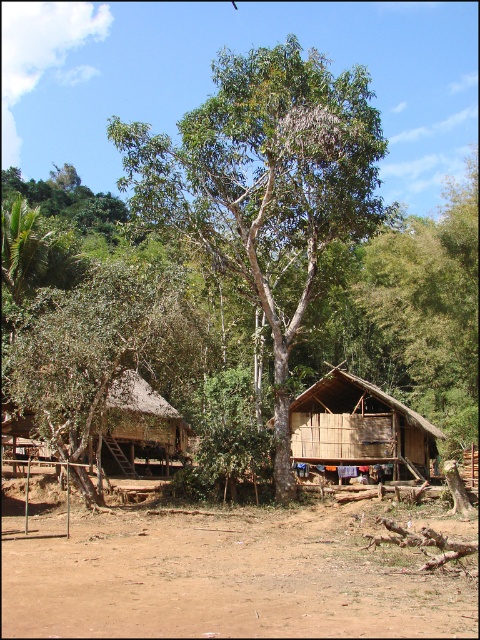
Question: From the image, what is the correct spatial relationship of brown sandy ground at center in relation to bamboo hut at center?

Choices:
 (A) above
 (B) below

Answer: (B)

Question: Among these points, which one is farthest from the camera?

Choices:
 (A) (412, 444)
 (B) (131, 209)
 (C) (166, 436)

Answer: (C)

Question: Among these points, which one is farthest from the camera?

Choices:
 (A) (265, 522)
 (B) (90, 321)

Answer: (B)

Question: Is green leafy tree at center below brown thatched hut at left?

Choices:
 (A) no
 (B) yes

Answer: (A)

Question: Which of the following is the farthest from the observer?

Choices:
 (A) green leafy tree at center
 (B) brown thatched hut at left
 (C) green leafy tree at left
 (D) bamboo hut at center

Answer: (D)

Question: In this image, where is green leafy tree at center located relative to green leafy tree at left?

Choices:
 (A) above
 (B) below

Answer: (A)